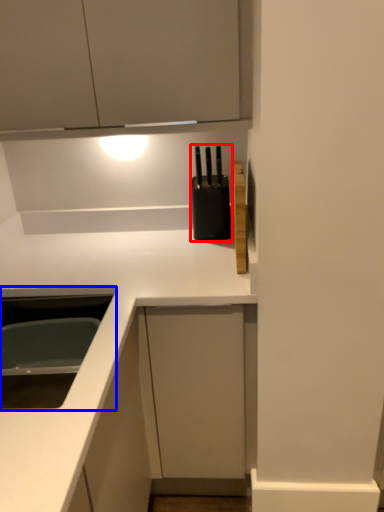
Question: Which of the following is the closest to the observer, appliance (highlighted by a red box) or sink (highlighted by a blue box)?

Choices:
 (A) appliance
 (B) sink

Answer: (B)